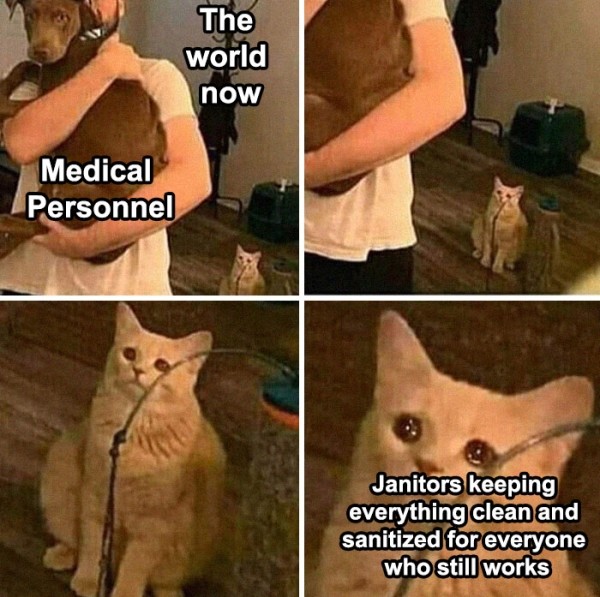
This screenshot has height=597, width=600. Find the location of `coat rack in top left square`. coat rack in top left square is located at coordinates (218, 112).